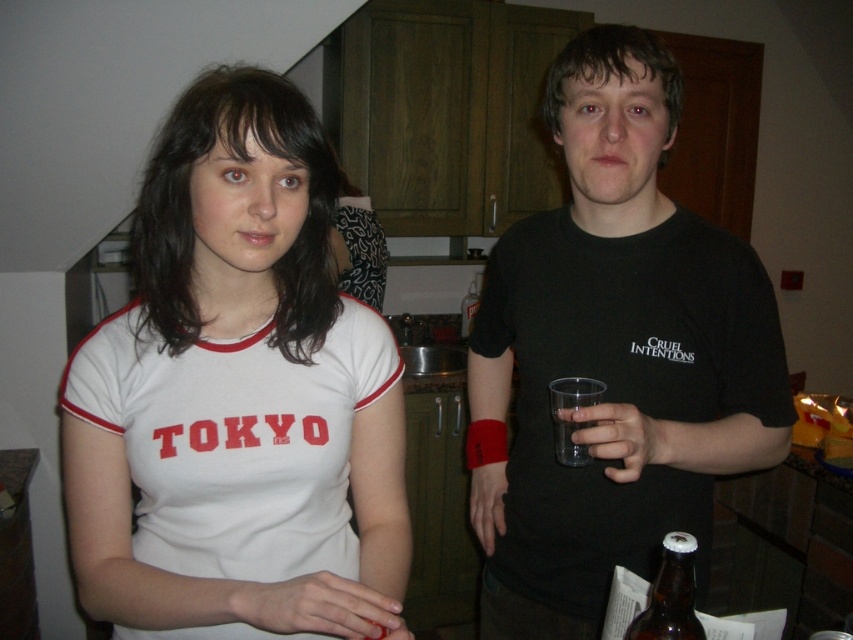
You are standing in a kitchen and see two points marked on the wall. The first point is at coordinates point (737, 272) and the second is at point (469, 317). Which point is closer to you?

Point (737, 272) is in front of point (469, 317), so it is closer to you.